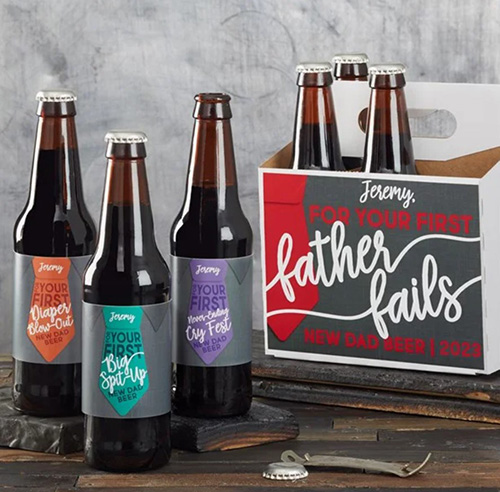
What are the coordinates of `grain lines in wood` in the screenshot? It's located at (377, 434), (367, 420), (27, 457).